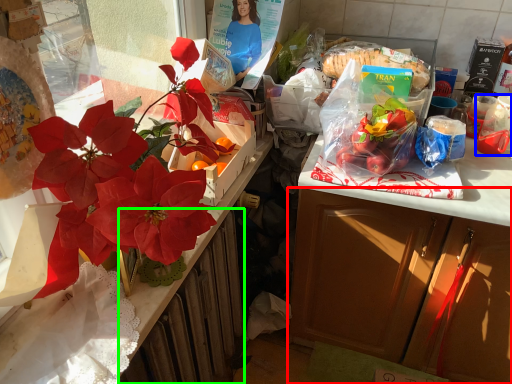
Question: Which is farther away from cabinetry (highlighted by a red box)? coffee cup (highlighted by a blue box) or radiator (highlighted by a green box)?

Choices:
 (A) coffee cup
 (B) radiator

Answer: (A)